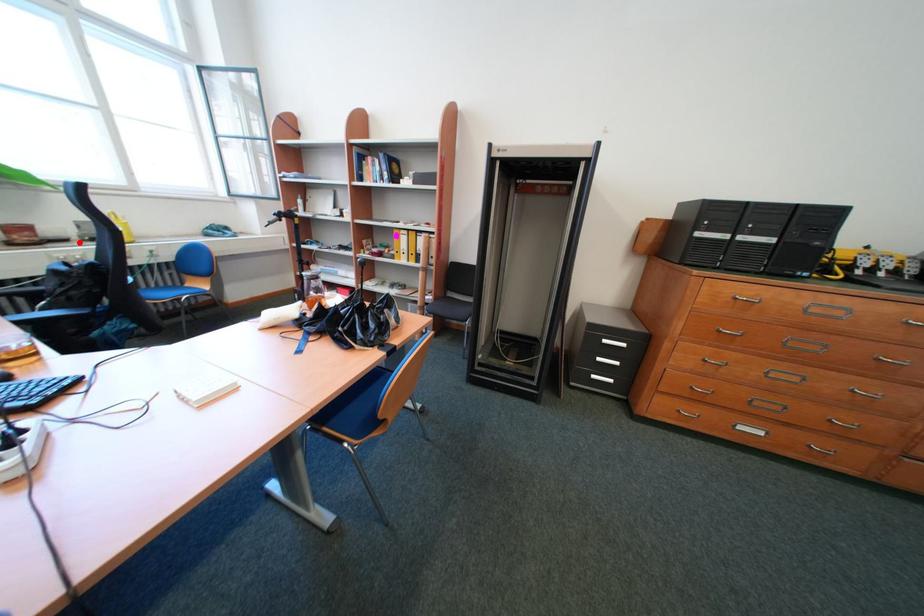
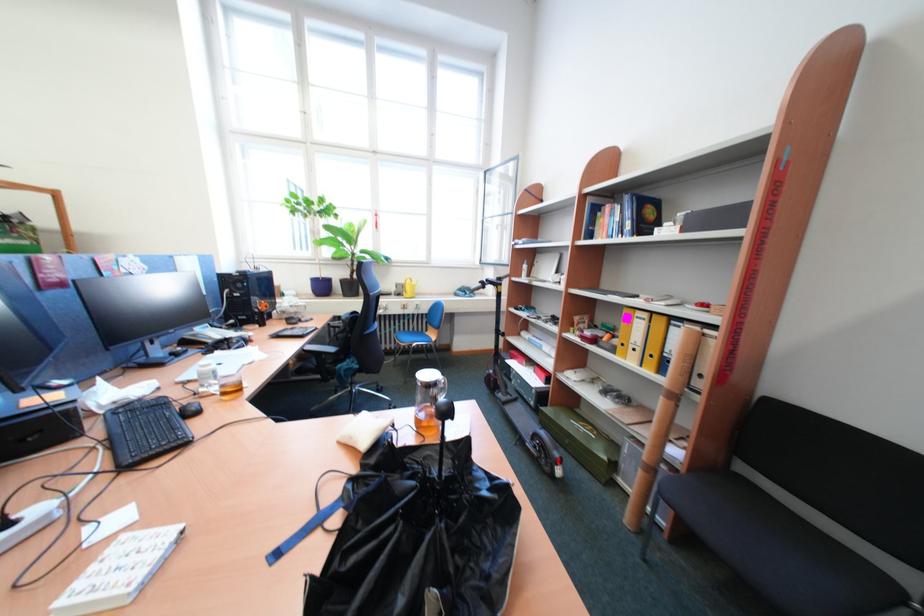
Where in the second image is the point corresponding to the highlighted location from the first image?

(403, 296)